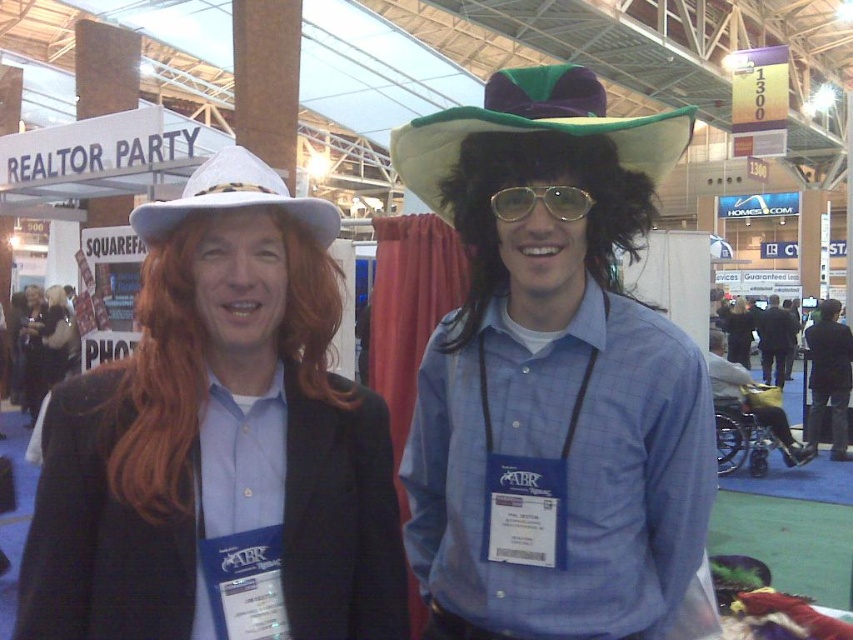
Question: Does white fabric cowboy hat at upper left lie behind gold metallic glasses at center?

Choices:
 (A) no
 (B) yes

Answer: (A)

Question: Considering the real-world distances, which object is closest to the gold metallic glasses at center?

Choices:
 (A) matte black jacket at center
 (B) matte blue shirt at center
 (C) matte white hat at left

Answer: (B)

Question: Is green felt cowboy hat at center in front of gold metallic glasses at center?

Choices:
 (A) yes
 (B) no

Answer: (A)

Question: Can you confirm if green felt cowboy hat at center is wider than matte black jacket at center?

Choices:
 (A) yes
 (B) no

Answer: (B)

Question: Which is farther from the matte black jacket at center?

Choices:
 (A) blue plaid shirt at center
 (B) white fabric cowboy hat at upper left

Answer: (A)

Question: Which is farther from the green felt cowboy hat at center?

Choices:
 (A) matte white hat at left
 (B) black fabric jacket at lower right
 (C) blue plaid shirt at center
 (D) matte black jacket at center

Answer: (C)